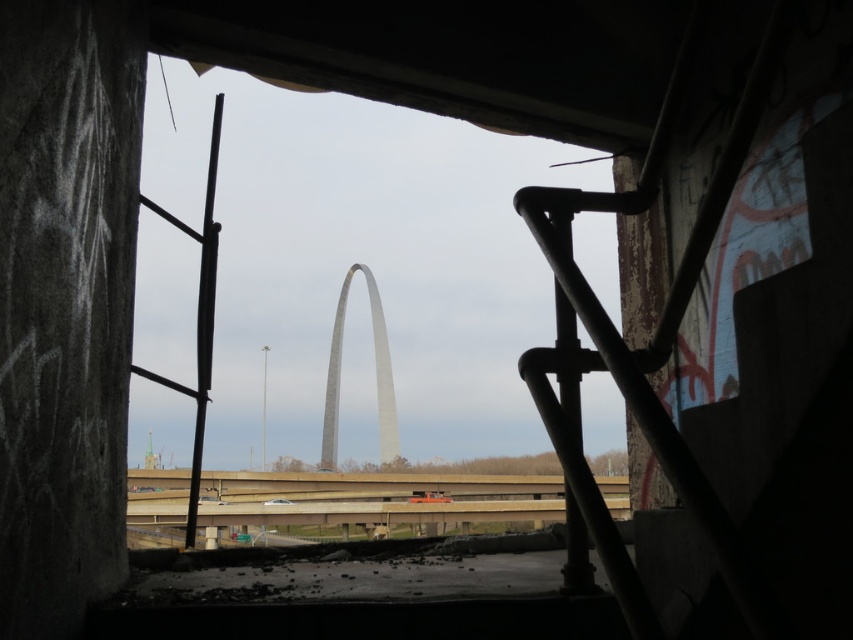
You are an inspector checking the structural integrity of the building. You notice the rusty metal ladder at left and the gray metallic arch at center. Which object is taller in the scene?

The rusty metal ladder at left is taller than the gray metallic arch at center.

You are inside an abandoned building and want to exit through the window. The rusty metal ladder at left and the gray metallic arch at center are visible. Which object is closer to you as you stand inside the building?

The rusty metal ladder at left is closer to you because it is in front of the gray metallic arch at center, which is further away.

Looking at this image, you are inside a building and looking out through a window. You see a rusty metal ladder at left and a gray metallic arch at center. Which object is higher from the ground?

The rusty metal ladder at left is located above the gray metallic arch at center, so it is higher from the ground.